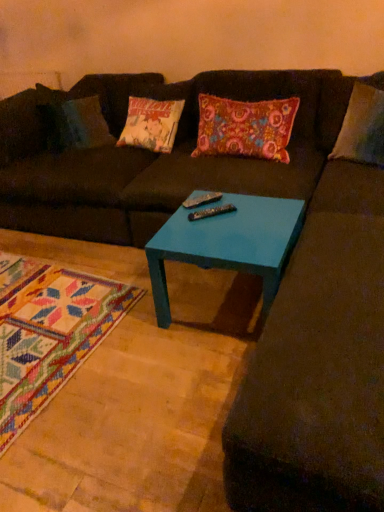
Image resolution: width=384 pixels, height=512 pixels. Identify the location of space that is in front of metallic silver remote at center, which appears as the 2th remote when viewed from the front. (206, 226).